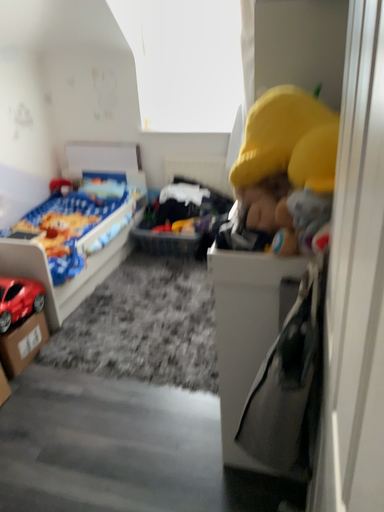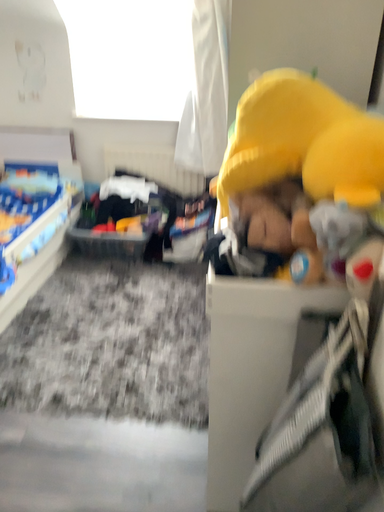
Question: Which way did the camera rotate in the video?

Choices:
 (A) rotated left
 (B) rotated right

Answer: (B)